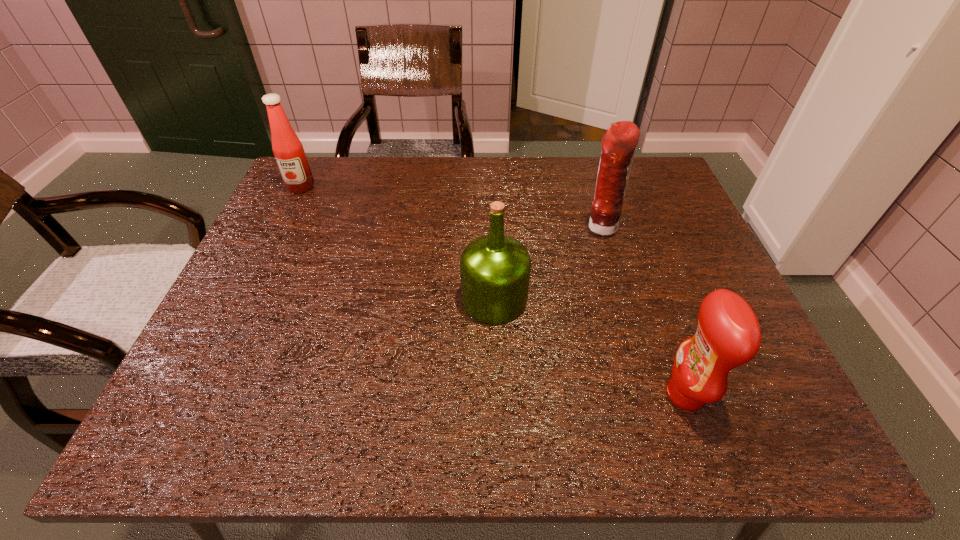
Where is `vacant area that satisfies the following two spatial constraints: 1. on the front-facing side of the leftmost condiment; 2. on the right side of the olive oil`? This screenshot has height=540, width=960. vacant area that satisfies the following two spatial constraints: 1. on the front-facing side of the leftmost condiment; 2. on the right side of the olive oil is located at coordinates (246, 299).